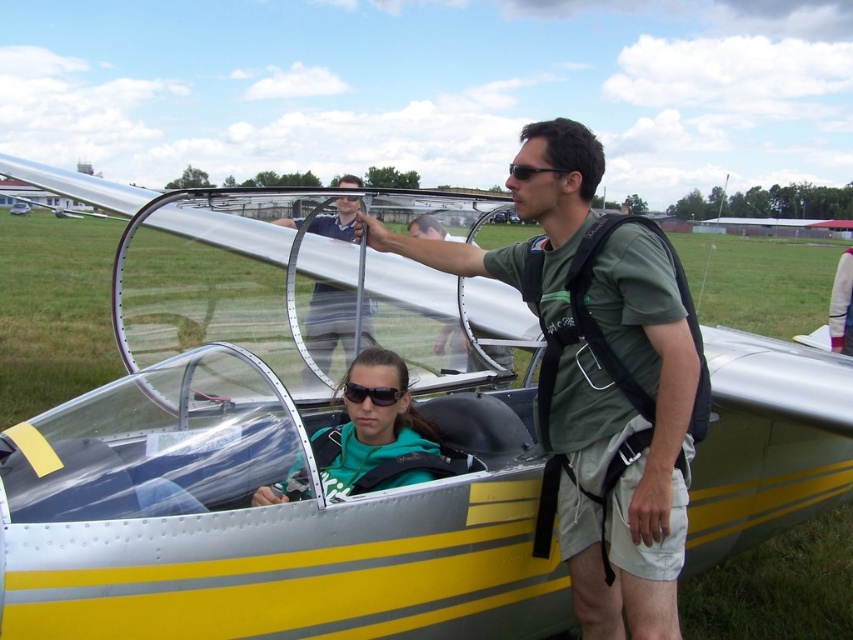
Between point (669, 353) and point (527, 170), which one is positioned behind?

The point (527, 170) is more distant.

Is green fabric shirt at center thinner than black matte sunglasses at center?

Incorrect, green fabric shirt at center's width is not less than black matte sunglasses at center's.

Where is `green fabric shirt at center`? The height and width of the screenshot is (640, 853). green fabric shirt at center is located at coordinates tap(612, 392).

Which of these two, green fabric shirt at center or black plastic sunglasses at center, stands shorter?

With less height is black plastic sunglasses at center.

You are a GUI agent. You are given a task and a screenshot of the screen. Output one action in this format:
    pyautogui.click(x=<x>, y=<y>)
    Task: Click on the green fabric shirt at center
    The width and height of the screenshot is (853, 640).
    Given the screenshot: What is the action you would take?
    pyautogui.click(x=612, y=392)

I want to click on green fabric shirt at center, so click(x=612, y=392).

Is matte black helmet at center above black matte sunglasses at center?

No, matte black helmet at center is not above black matte sunglasses at center.

Which is more to the right, matte black helmet at center or black matte sunglasses at center?

Positioned to the right is black matte sunglasses at center.

You are a GUI agent. You are given a task and a screenshot of the screen. Output one action in this format:
    pyautogui.click(x=<x>, y=<y>)
    Task: Click on the matte black helmet at center
    
    Given the screenshot: What is the action you would take?
    pyautogui.click(x=329, y=323)